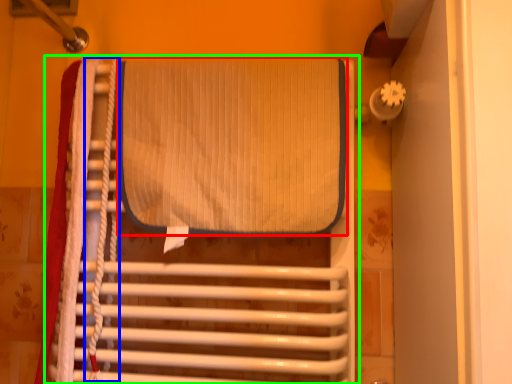
Question: Which is farther away from wide (highlighted by a red box)? rope (highlighted by a blue box) or furniture (highlighted by a green box)?

Choices:
 (A) rope
 (B) furniture

Answer: (A)